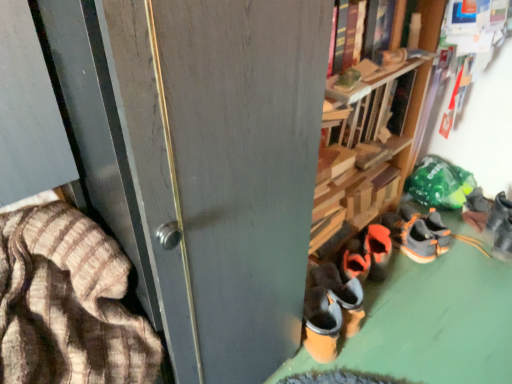
Find the location of a particular element. The image size is (512, 384). free space in front of orange suede shoes at center, the fourth footwear viewed from the right is located at coordinates (403, 300).